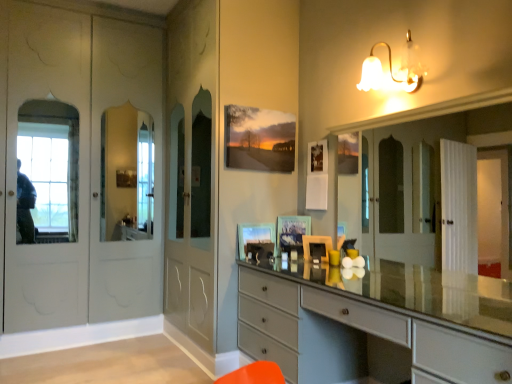
Question: Which direction should I rotate to look at matte glass picture frame at center, marked as the 2th picture frame in a left-to-right arrangement, — up or down?

Choices:
 (A) down
 (B) up

Answer: (A)

Question: Is matte glass picture frame at center, the 1th picture frame from the left, taller than white glass bell-shaped light fixture at upper right?

Choices:
 (A) no
 (B) yes

Answer: (A)

Question: Is the depth of matte glass picture frame at center, the 1th picture frame from the left, greater than that of white glass bell-shaped light fixture at upper right?

Choices:
 (A) no
 (B) yes

Answer: (B)

Question: Considering the relative positions of matte glass picture frame at center, which is the 2th picture frame from right to left, and white glass bell-shaped light fixture at upper right in the image provided, is matte glass picture frame at center, which is the 2th picture frame from right to left, to the left of white glass bell-shaped light fixture at upper right from the viewer's perspective?

Choices:
 (A) no
 (B) yes

Answer: (B)

Question: Could you tell me if matte glass picture frame at center, which is the 2th picture frame from right to left, is facing white glass bell-shaped light fixture at upper right?

Choices:
 (A) no
 (B) yes

Answer: (A)

Question: Does matte glass picture frame at center, which is the 2th picture frame from right to left, have a lesser height compared to white glass bell-shaped light fixture at upper right?

Choices:
 (A) yes
 (B) no

Answer: (A)

Question: From a real-world perspective, is matte glass picture frame at center, which is the 2th picture frame from right to left, located beneath white glass bell-shaped light fixture at upper right?

Choices:
 (A) no
 (B) yes

Answer: (B)

Question: Considering the relative sizes of matte glass picture frame at center, the 1th picture frame from the left, and matte gray chest of drawers at center in the image provided, is matte glass picture frame at center, the 1th picture frame from the left, thinner than matte gray chest of drawers at center?

Choices:
 (A) no
 (B) yes

Answer: (B)

Question: Is matte glass picture frame at center, which is the 2th picture frame from right to left, shorter than matte gray chest of drawers at center?

Choices:
 (A) yes
 (B) no

Answer: (A)

Question: Is matte glass picture frame at center, which is the 2th picture frame from right to left, facing away from matte gray chest of drawers at center?

Choices:
 (A) no
 (B) yes

Answer: (A)

Question: Does matte glass picture frame at center, which is the 2th picture frame from right to left, have a smaller size compared to matte gray chest of drawers at center?

Choices:
 (A) no
 (B) yes

Answer: (B)

Question: Does matte glass picture frame at center, which is the 2th picture frame from right to left, turn towards matte gray chest of drawers at center?

Choices:
 (A) no
 (B) yes

Answer: (A)

Question: Is matte glass picture frame at center, which is the 2th picture frame from right to left, at the right side of matte gray chest of drawers at center?

Choices:
 (A) no
 (B) yes

Answer: (A)

Question: From a real-world perspective, is matte gray chest of drawers at center on white glass bell-shaped light fixture at upper right?

Choices:
 (A) no
 (B) yes

Answer: (A)